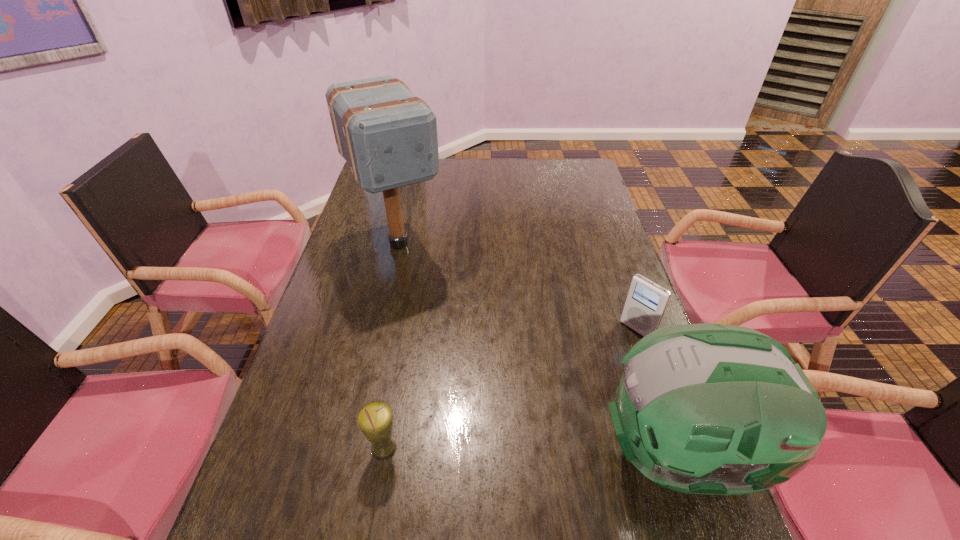
This screenshot has height=540, width=960. What are the coordinates of `free space on the desktop that is between the second shortest object and the football helmet and is positioned on the front-facing side of the iPod` in the screenshot? It's located at (503, 451).

Find the location of a particular element. free space on the desktop that is between the third tallest object and the football helmet and is positioned on the striking surface of the farthest object is located at coordinates (524, 452).